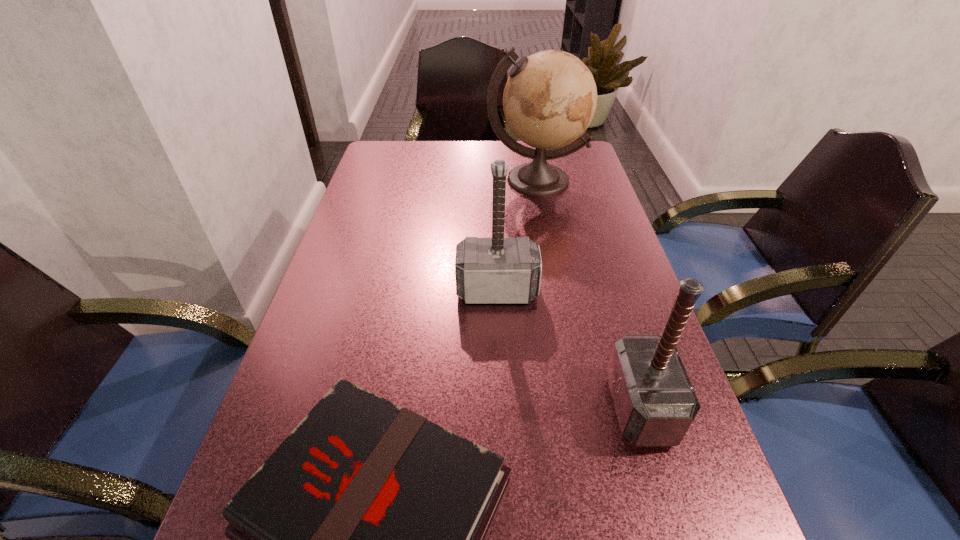
At what (x,y) coordinates should I click in order to perform the action: click on object that is the nearest to the globe. Please return your answer as a coordinate pair (x, y). The height and width of the screenshot is (540, 960). Looking at the image, I should click on (488, 270).

Locate an element on the screen. The height and width of the screenshot is (540, 960). the third closest object to the nearer hammer is located at coordinates (550, 98).

I want to click on vacant point that satisfies the following two spatial constraints: 1. for striking with the head of the nearer hammer; 2. on the left side of the left hammer, so click(x=502, y=407).

Find the location of a particular element. The image size is (960, 540). vacant space that satisfies the following two spatial constraints: 1. on the front-facing side of the right hammer; 2. on the right side of the farthest object is located at coordinates (578, 407).

Identify the location of blank space that satisfies the following two spatial constraints: 1. on the front-facing side of the nearer hammer; 2. on the left side of the globe. (578, 407).

The width and height of the screenshot is (960, 540). What are the coordinates of `vacant area in the image that satisfies the following two spatial constraints: 1. on the front-facing side of the tallest object; 2. on the left side of the nearer hammer` in the screenshot? It's located at (578, 407).

Where is `free spot that satisfies the following two spatial constraints: 1. for striking with the head of the second farthest object; 2. on the right side of the nearer hammer`? free spot that satisfies the following two spatial constraints: 1. for striking with the head of the second farthest object; 2. on the right side of the nearer hammer is located at coordinates (502, 407).

You are a GUI agent. You are given a task and a screenshot of the screen. Output one action in this format:
    pyautogui.click(x=<x>, y=<y>)
    Task: Click on the blank space that satisfies the following two spatial constraints: 1. for striking with the head of the nearer hammer; 2. on the left side of the left hammer
    
    Given the screenshot: What is the action you would take?
    tap(502, 407)